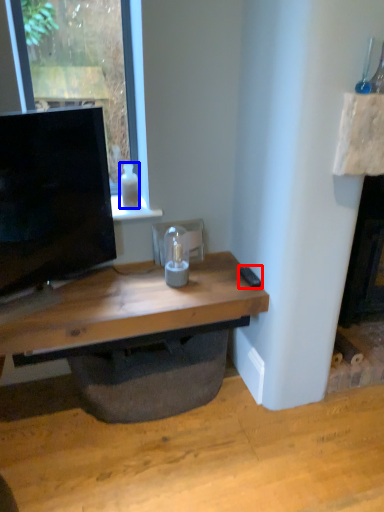
Question: Which object appears closest to the camera in this image, remote control (highlighted by a red box) or bottle (highlighted by a blue box)?

Choices:
 (A) remote control
 (B) bottle

Answer: (A)